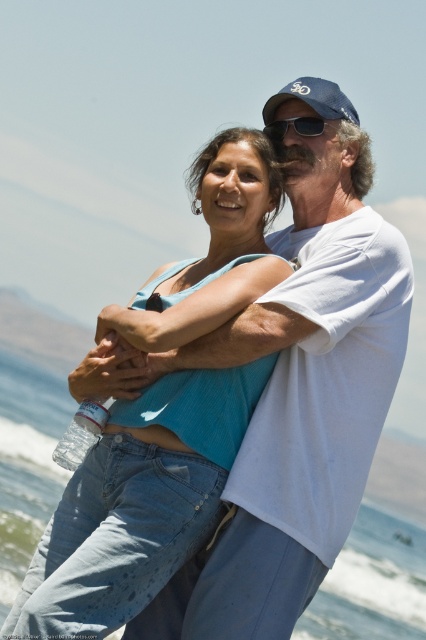
You are a photographer at the beach scene. You need to place a small decorative item between the blue denim jeans at center and the transparent plastic water at center. Based on their widths, which object should the item be closer to?

The blue denim jeans at center has a lesser width compared to transparent plastic water at center, so the item should be placed closer to the blue denim jeans at center to balance the composition.

Based on the scene description, where is the blue denim jeans at center positioned in terms of coordinates?

The blue denim jeans at center is located at point (137,504) according to the provided coordinates.

What are the coordinates of the blue denim jeans at center?

The blue denim jeans at center are located at coordinates point (x=137, y=504).